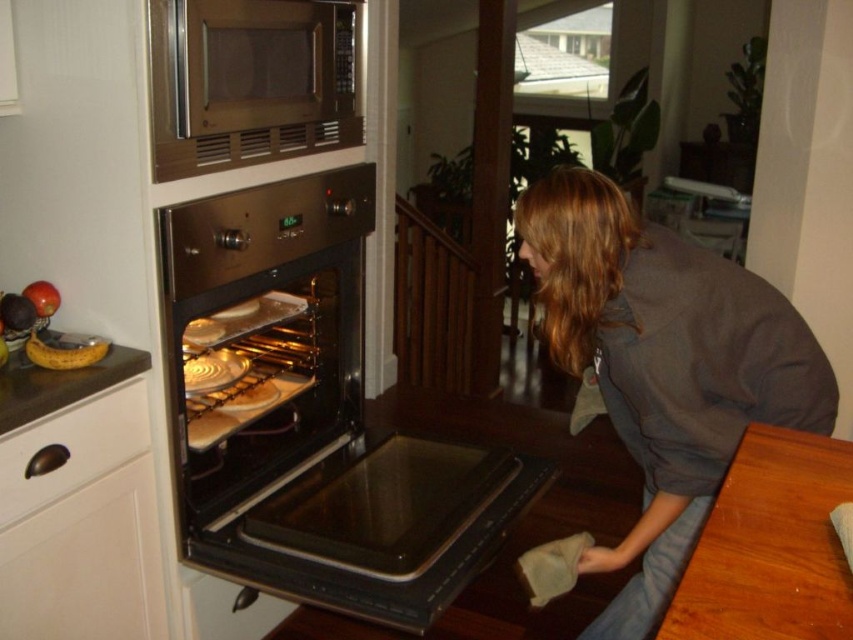
You are a delivery robot with a package that is 24 inches wide. You need to place it between the stainless steel oven at center and the dark gray sweatshirt at lower right. Is there enough space?

The stainless steel oven at center and dark gray sweatshirt at lower right are 23.18 inches apart from each other. Since the package is 24 inches wide, it is slightly wider than the available space. Therefore, there is not enough space to place the package between them.

What is located at the coordinates point (291, 396) in the kitchen scene?

The stainless steel oven at center is located at point (291, 396).